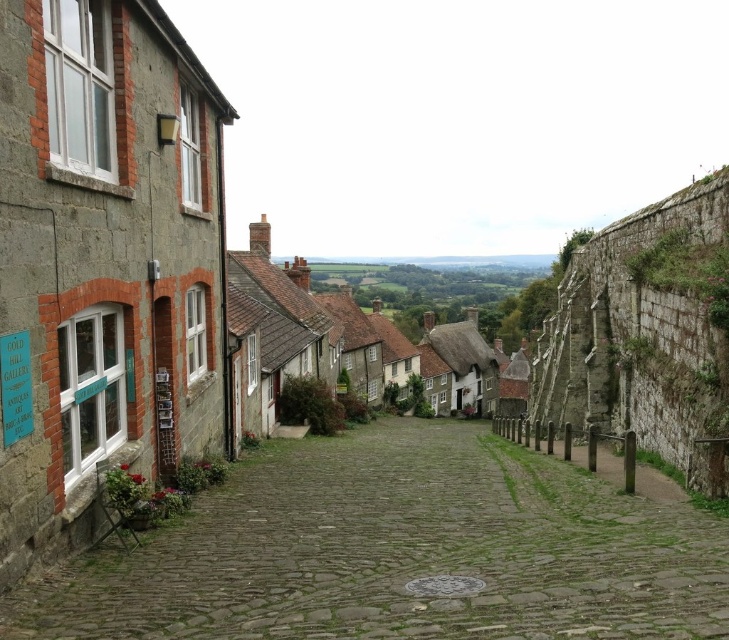
You are a delivery person carrying a large package that is 2 meters wide. You need to navigate through the narrow cobblestone street. Can you pass through the green cobblestone path at center without touching the rustic stone houses at center?

The green cobblestone path at center has a lesser width compared to rustic stone houses at center. Since the path is narrower than the houses, and your package is 2 meters wide, you need to check if the path is wide enough. However, the exact width of the path isn not provided, so it is uncertain whether the package can pass without touching the houses.

You are a tourist walking along the narrow cobblestone street in the quaint village. You see a green cobblestone path at center and rustic stone houses at center. Which object is located lower in the scene?

The green cobblestone path at center is below rustic stone houses at center, so the green cobblestone path at center is located lower in the scene.